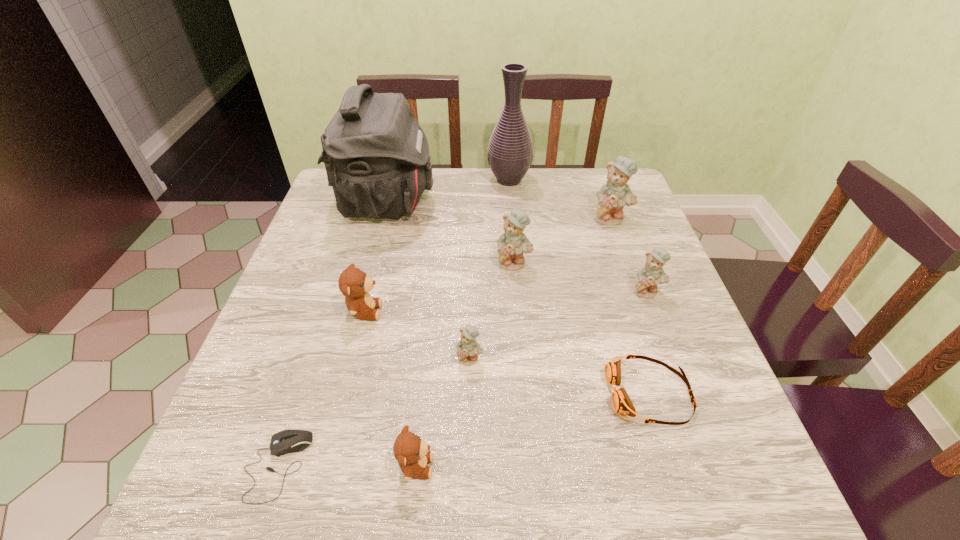
Identify the location of free space located on the front-facing side of the second smallest blue teddy bear. Image resolution: width=960 pixels, height=540 pixels. (689, 403).

The height and width of the screenshot is (540, 960). I want to click on free location located 0.130m on the front-facing side of the nearest blue teddy bear, so click(468, 430).

Where is `vacant region located 0.350m on the face of the nearer brown teddy bear`? This screenshot has height=540, width=960. vacant region located 0.350m on the face of the nearer brown teddy bear is located at coordinates point(646,466).

Where is `vacant area situated 0.060m with the lenses facing forward on the ninth tallest object`? This screenshot has width=960, height=540. vacant area situated 0.060m with the lenses facing forward on the ninth tallest object is located at coordinates (575, 394).

This screenshot has height=540, width=960. In order to click on vacant space situated 0.310m with the lenses facing forward on the ninth tallest object in this screenshot , I will do `click(442, 394)`.

Identify the location of free region located with the lenses facing forward on the ninth tallest object. The height and width of the screenshot is (540, 960). coord(511,394).

Identify the location of free space located on the right of the computer mouse. The height and width of the screenshot is (540, 960). (477, 466).

Find the location of a particular element. Image resolution: width=960 pixels, height=540 pixels. vase situated at the far edge is located at coordinates (510, 151).

Find the location of a particular element. shoulder bag located in the far edge section of the desktop is located at coordinates (376, 155).

Locate an element on the screen. The image size is (960, 540). teddy bear that is at the far edge is located at coordinates (612, 197).